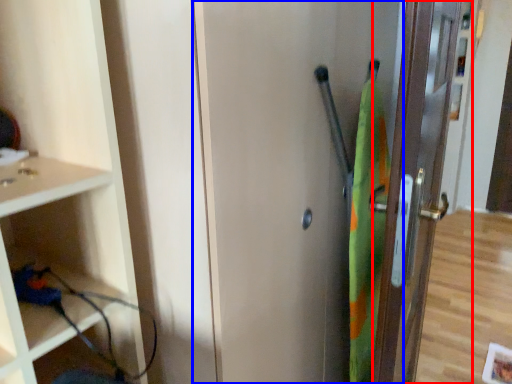
Question: Which object appears farthest to the camera in this image, door (highlighted by a red box) or screen door (highlighted by a blue box)?

Choices:
 (A) door
 (B) screen door

Answer: (A)